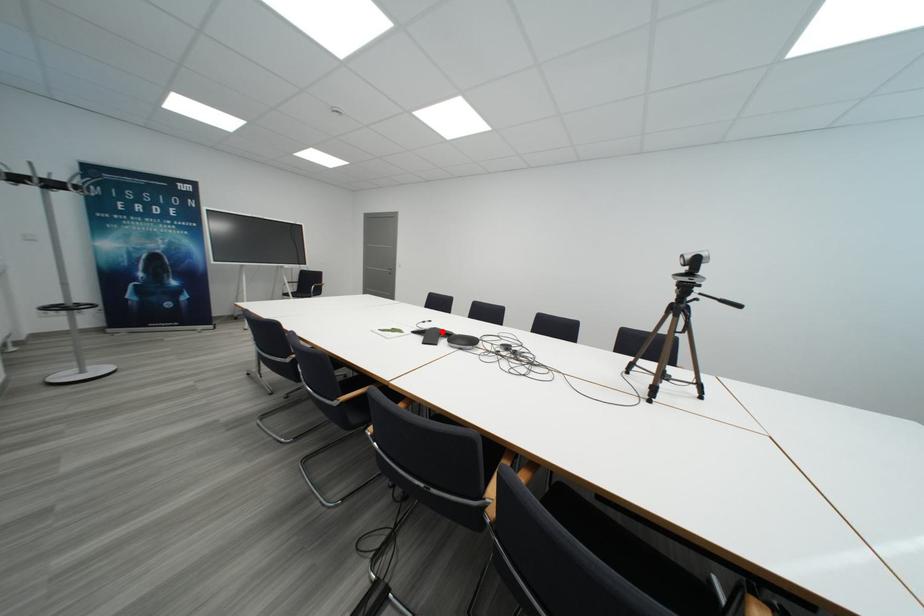
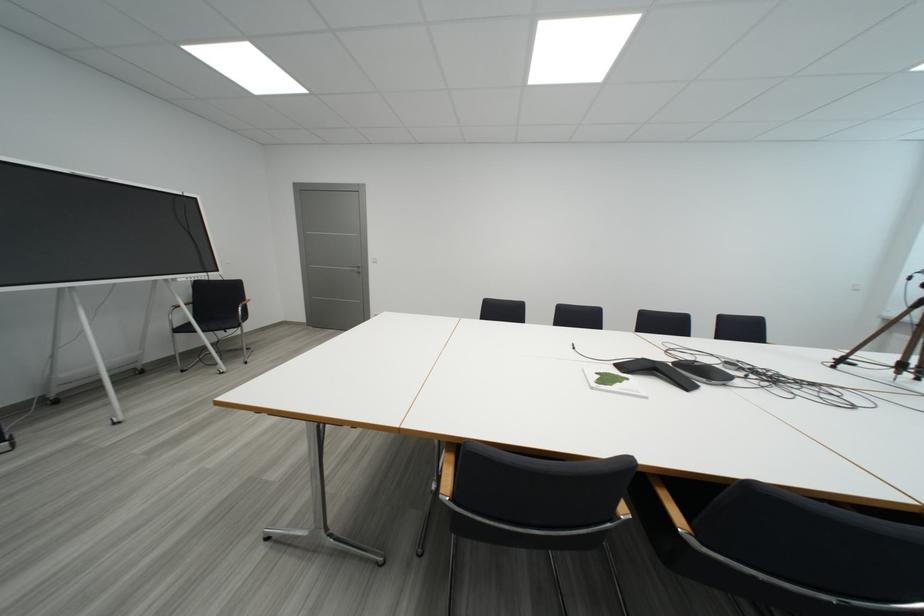
Question: I am providing you with two images of the same scene from different viewpoints. A red point is marked on the first image. Is the red point's position out of view in image 2?

Choices:
 (A) Yes
 (B) No

Answer: (B)